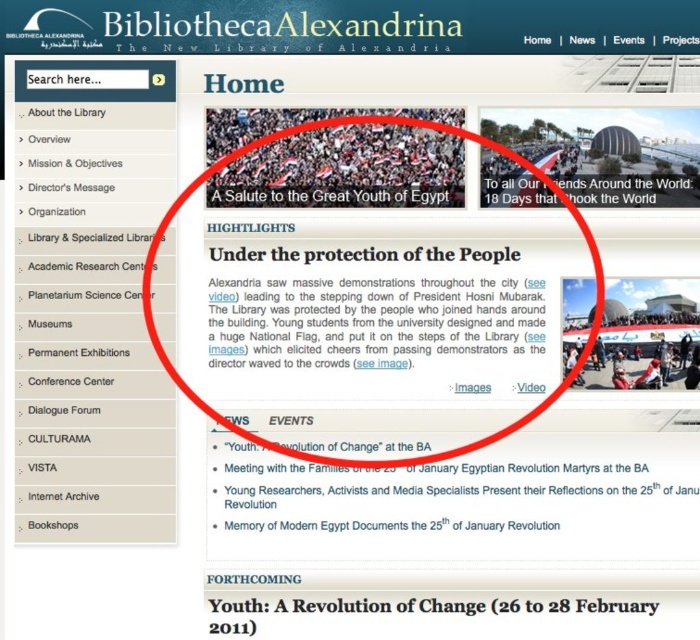
You are a user navigating the Bibliotheca Alexandrina website. You notice two points on the page. The first point is located at coordinates point (659, 120) and the second point is at point (687, 284). If you were to look at the webpage from the front, which point would appear closer to you?

Point (687, 284) is closer to you because it is in front of point (659, 120).

You are designing a layout for a new website and want to ensure proper spacing between the blue fabric banner at upper right and the matte black flag at center. Which object should be placed higher up to maintain visual balance?

The blue fabric banner at upper right is shorter than the matte black flag at center, so placing the shorter blue fabric banner at upper right higher up would help maintain visual balance by compensating for its smaller size.